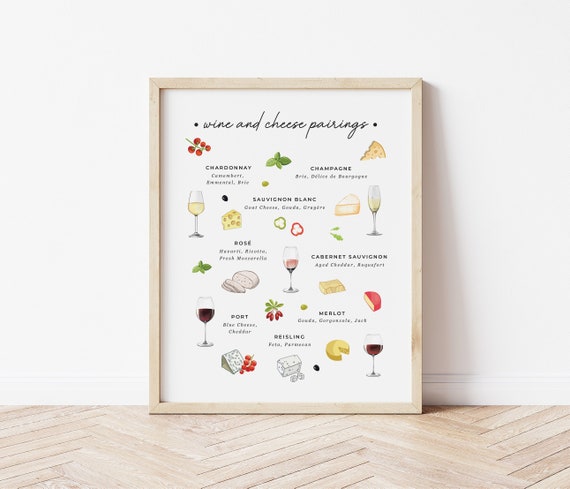
In order to click on light wood in this screenshot , I will do [168, 408].